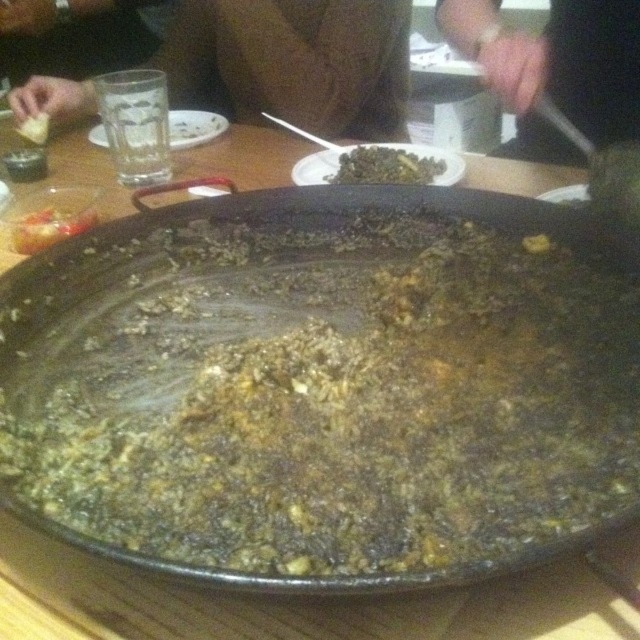
Is black leather wristband at upper center positioned behind shiny plastic fork at upper left?

No, black leather wristband at upper center is in front of shiny plastic fork at upper left.

The width and height of the screenshot is (640, 640). What do you see at coordinates (557, 68) in the screenshot? I see `black leather wristband at upper center` at bounding box center [557, 68].

Does point (561, 145) come farther from viewer compared to point (35, 237)?

Yes, point (561, 145) is farther from viewer.

The width and height of the screenshot is (640, 640). I want to click on black leather wristband at upper center, so click(557, 68).

How much distance is there between brown leather jacket at upper center and green matte rice at center?

A distance of 14.54 inches exists between brown leather jacket at upper center and green matte rice at center.

Locate an element on the screen. The height and width of the screenshot is (640, 640). brown leather jacket at upper center is located at coordinates (294, 61).

Does point (365, 26) lie in front of point (346, 154)?

No, (365, 26) is further to viewer.

Locate an element on the screen. This screenshot has height=640, width=640. brown leather jacket at upper center is located at coordinates (294, 61).

Is black matte wok at center wider than white crumbly food at center?

Indeed, black matte wok at center has a greater width compared to white crumbly food at center.

Is point (384, 396) closer to camera compared to point (45, 118)?

Yes, it is.

Is point (157, 320) positioned before point (35, 120)?

Yes, it is.

Find the location of a particular element. The width and height of the screenshot is (640, 640). black matte wok at center is located at coordinates (321, 387).